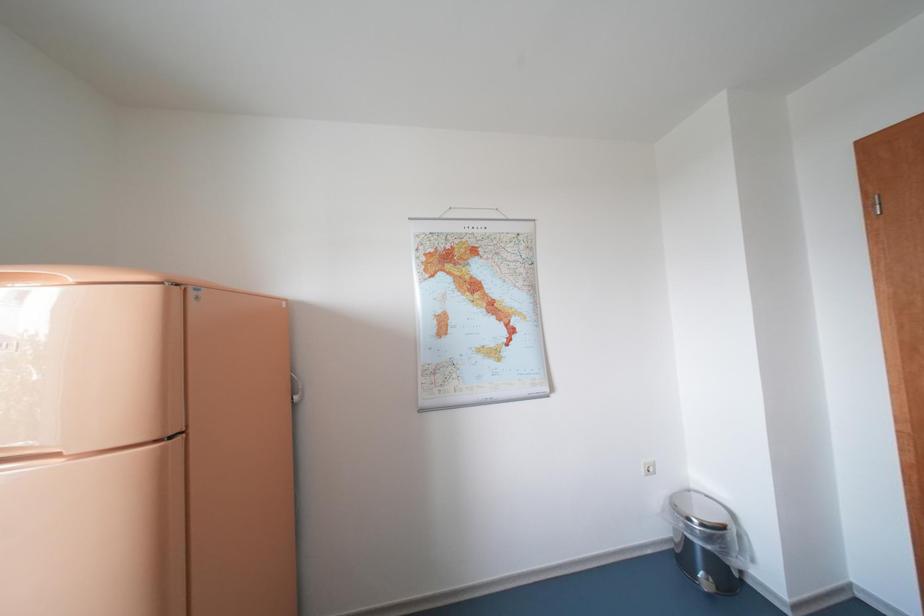
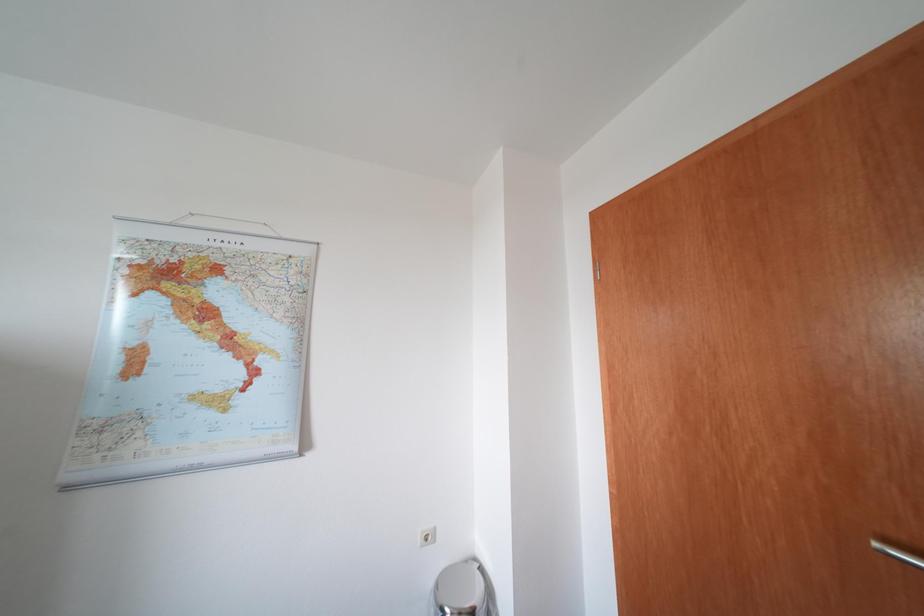
Question: How did the camera likely rotate?

Choices:
 (A) Left
 (B) Right
 (C) Up
 (D) Down

Answer: (B)